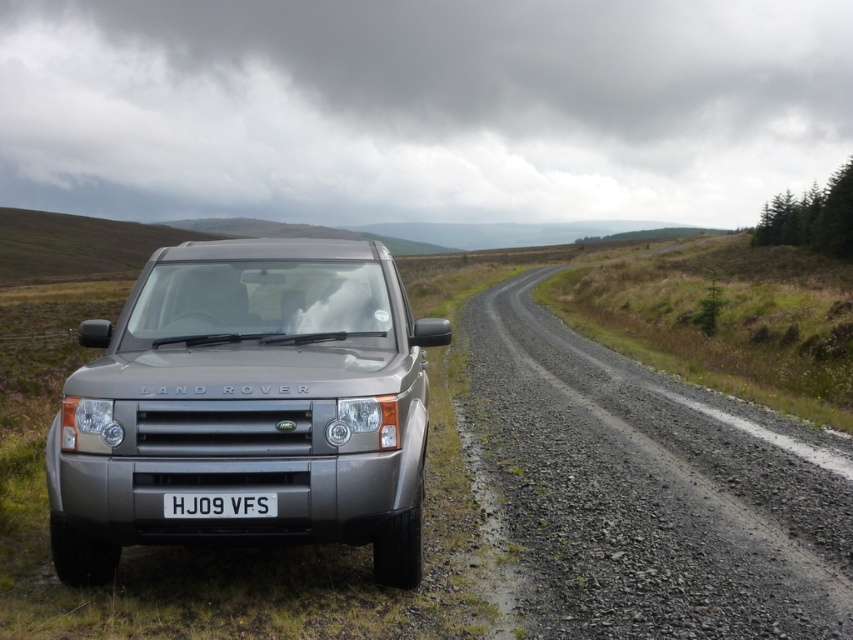
You are standing at the point marked as point (650,490) in the image. Based on the scene description, what is the terrain like at your current location?

The point (650,490) corresponds to gravel road at center, which is part of the gravel road in the rural, open landscape. The terrain here is a gravel road bordered by grassy fields on both sides, with an uneven surface covered in gravel.

Looking at this image, you are a photographer standing in front of the satin silver land rover at center and the white plastic license plate at center. You want to take a photo that includes both objects. Which object should you position closer to the left side of the camera frame?

The satin silver land rover at center is to the left of the white plastic license plate at center, so to include both in the photo, position the satin silver land rover at center closer to the left side of the camera frame.

You are driving a Land Rover and need to park it on the gravel road at center. The white plastic license plate at center is blocking part of the road. Can the Land Rover fit on the remaining road space next to the license plate?

The gravel road at center is wider than the white plastic license plate at center. Since the license plate is only blocking part of the road, there should be enough space remaining for the Land Rover to park alongside it.